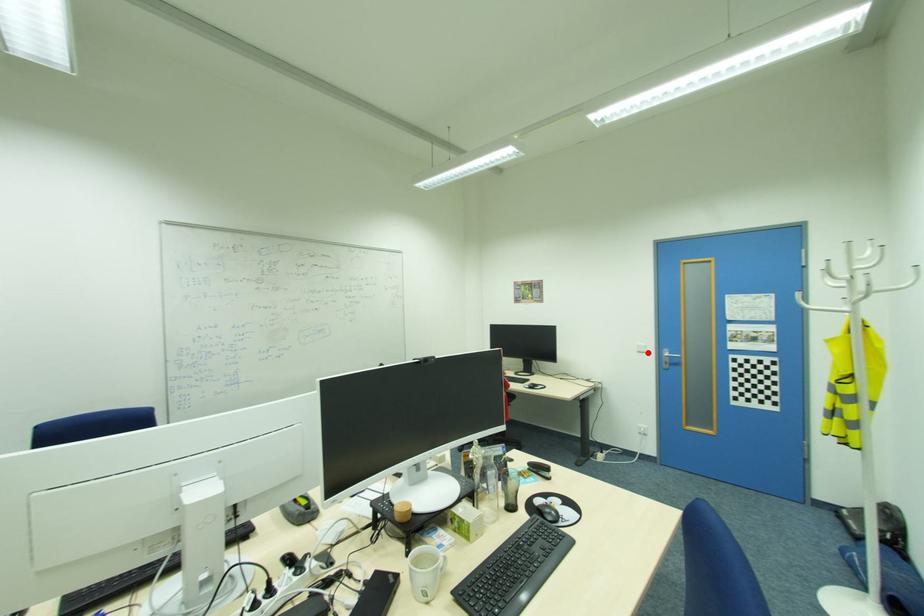
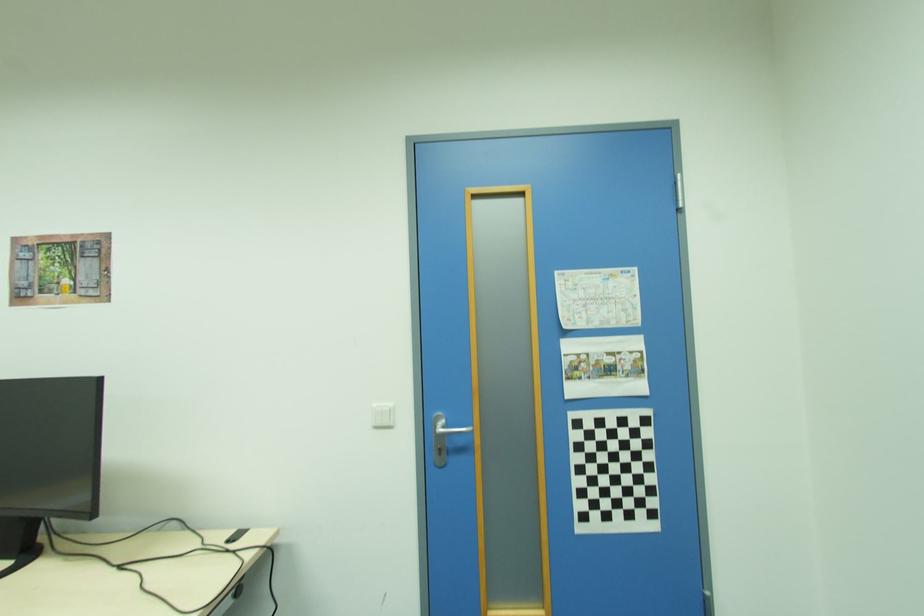
Question: I am providing you with two images of the same scene from different viewpoints. A red point is marked on the first image. At the location where the point appears in image 1, is it still visible in image 2?

Choices:
 (A) Yes
 (B) No

Answer: (A)